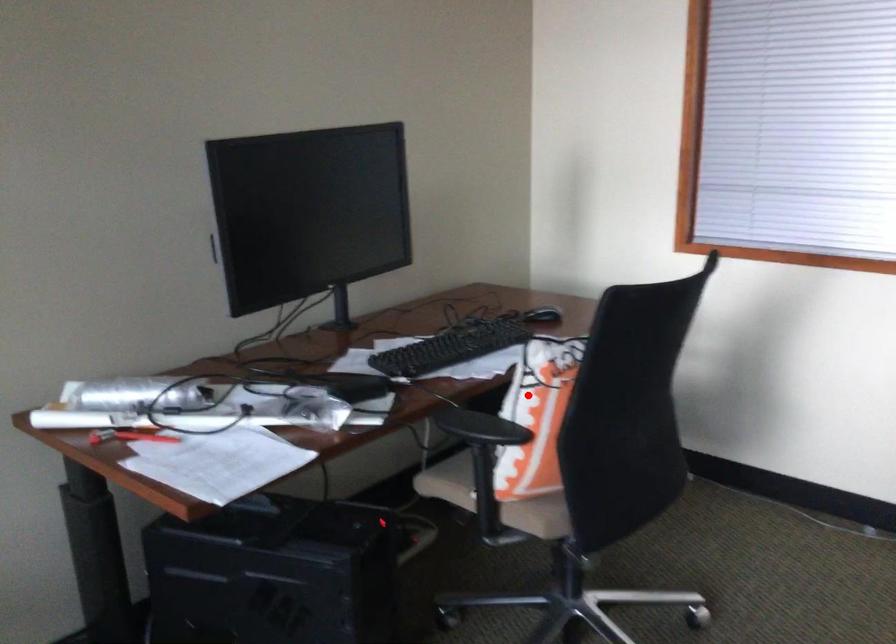
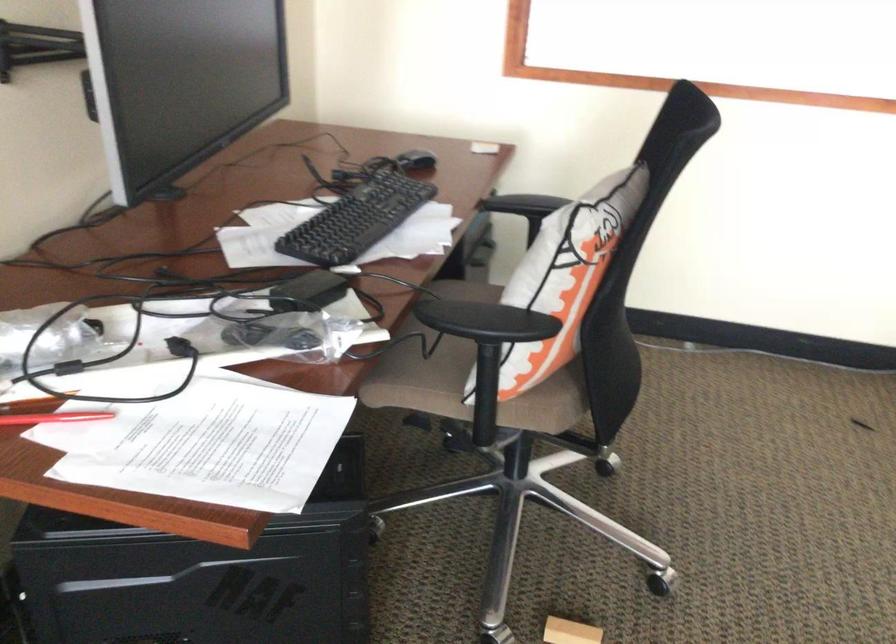
Locate, in the second image, the point that corresponds to the highlighted location in the first image.

(564, 277)